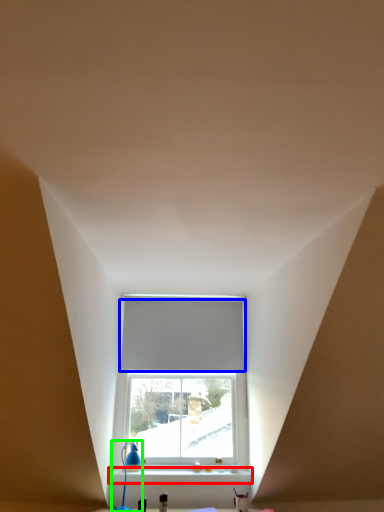
Question: Which object is positioned farthest from window sill (highlighted by a red box)? Select from blind (highlighted by a blue box) and table lamp (highlighted by a green box).

Choices:
 (A) blind
 (B) table lamp

Answer: (A)